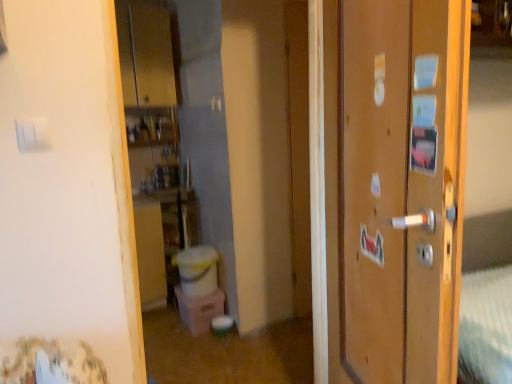
Question: From the image's perspective, relative to wooden door at right, is white plastic light switch at upper left above or below?

Choices:
 (A) below
 (B) above

Answer: (B)

Question: Relative to wooden door at right, is white plastic light switch at upper left in front or behind?

Choices:
 (A) front
 (B) behind

Answer: (B)

Question: Would you say white plastic light switch at upper left is to the left or to the right of wooden door at right in the picture?

Choices:
 (A) right
 (B) left

Answer: (B)

Question: From the image's perspective, is wooden door at right located above or below white plastic light switch at upper left?

Choices:
 (A) below
 (B) above

Answer: (A)

Question: Relative to white plastic light switch at upper left, is wooden door at right in front or behind?

Choices:
 (A) behind
 (B) front

Answer: (B)

Question: Is wooden door at right inside or outside of white plastic light switch at upper left?

Choices:
 (A) inside
 (B) outside

Answer: (B)

Question: Considering the positions of wooden door at right and white plastic light switch at upper left in the image, is wooden door at right wider or thinner than white plastic light switch at upper left?

Choices:
 (A) wide
 (B) thin

Answer: (A)